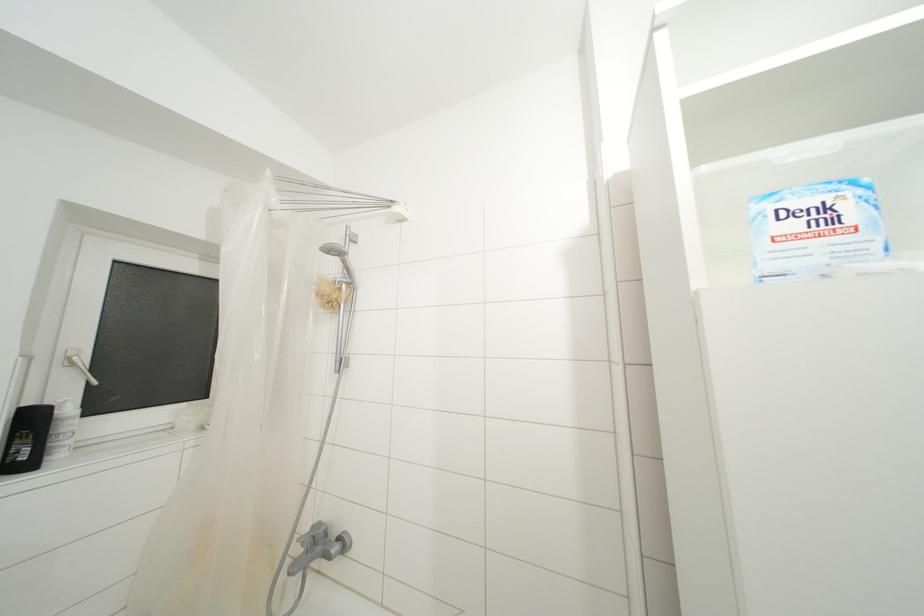
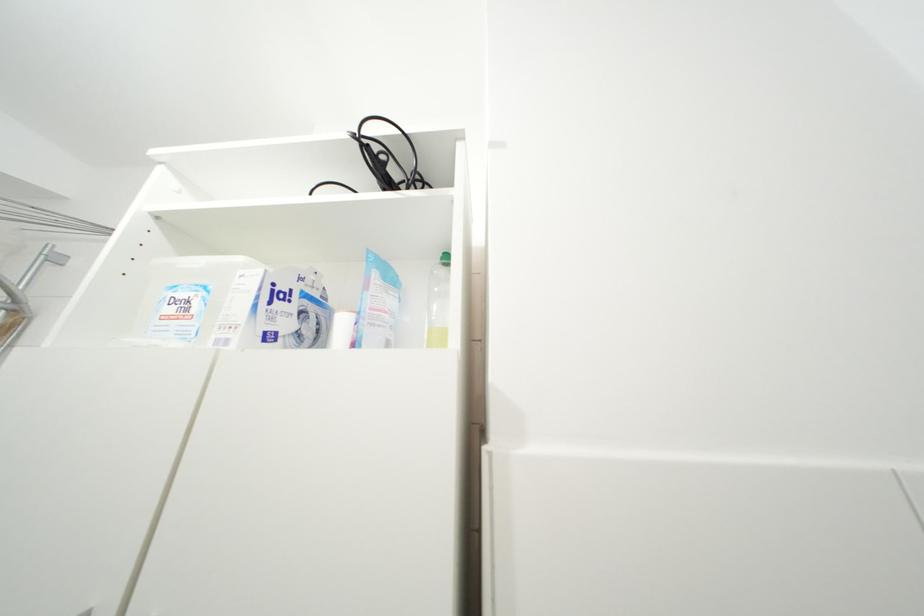
Question: The camera is either moving clockwise (left) or counter-clockwise (right) around the object. The first image is from the beginning of the video and the second image is from the end. Is the camera moving left or right when shooting the video?

Choices:
 (A) Left
 (B) Right

Answer: (A)